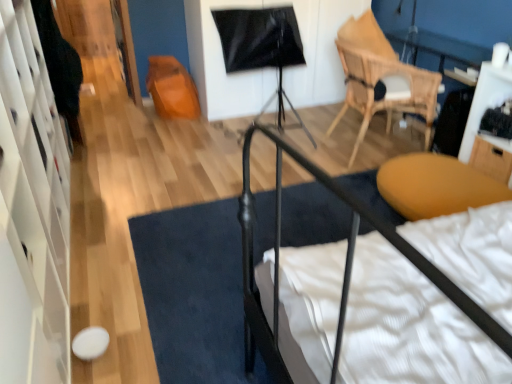
Question: Is natural wood chair at upper right closer to camera compared to black fabric doormat at center?

Choices:
 (A) yes
 (B) no

Answer: (B)

Question: From the image's perspective, is natural wood chair at upper right located beneath black fabric doormat at center?

Choices:
 (A) yes
 (B) no

Answer: (B)

Question: Is black fabric doormat at center at the back of natural wood chair at upper right?

Choices:
 (A) yes
 (B) no

Answer: (B)

Question: Does natural wood chair at upper right have a smaller size compared to black fabric doormat at center?

Choices:
 (A) no
 (B) yes

Answer: (A)

Question: Considering the relative sizes of natural wood chair at upper right and black fabric doormat at center in the image provided, is natural wood chair at upper right taller than black fabric doormat at center?

Choices:
 (A) yes
 (B) no

Answer: (A)

Question: From a real-world perspective, is natural wood chair at upper right below black fabric doormat at center?

Choices:
 (A) no
 (B) yes

Answer: (A)

Question: From the image's perspective, is wooden drawer at right above natural wood chair at upper right?

Choices:
 (A) yes
 (B) no

Answer: (B)

Question: From a real-world perspective, is wooden drawer at right positioned over natural wood chair at upper right based on gravity?

Choices:
 (A) no
 (B) yes

Answer: (A)

Question: Can you confirm if wooden drawer at right is positioned to the left of natural wood chair at upper right?

Choices:
 (A) no
 (B) yes

Answer: (A)

Question: Is the depth of wooden drawer at right less than that of natural wood chair at upper right?

Choices:
 (A) no
 (B) yes

Answer: (B)

Question: Can you confirm if wooden drawer at right is wider than natural wood chair at upper right?

Choices:
 (A) no
 (B) yes

Answer: (A)

Question: Is wooden drawer at right shorter than natural wood chair at upper right?

Choices:
 (A) no
 (B) yes

Answer: (B)

Question: Is white glossy dresser at left at the left side of black fabric doormat at center?

Choices:
 (A) no
 (B) yes

Answer: (B)